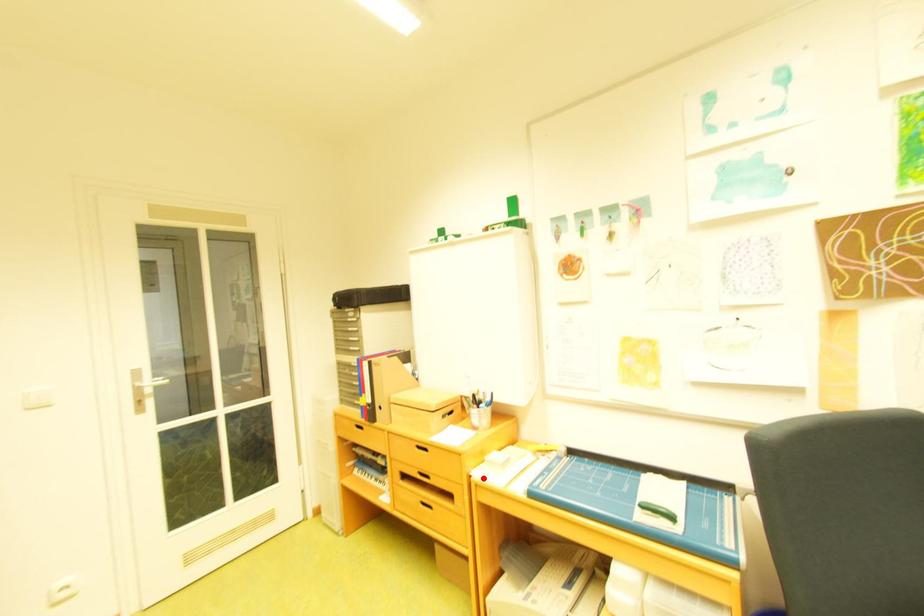
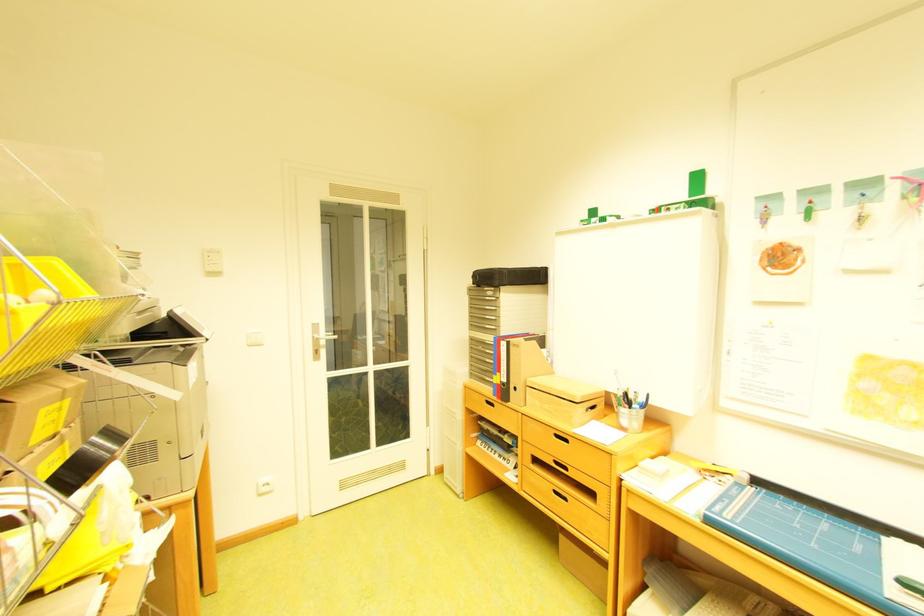
Where in the second image is the point corresponding to the highlighted location from the first image?

(635, 484)